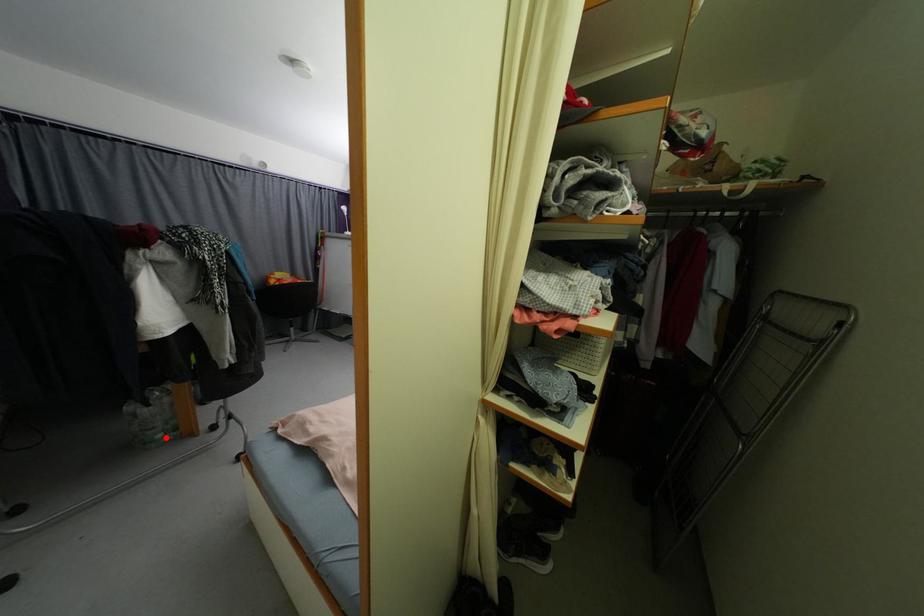
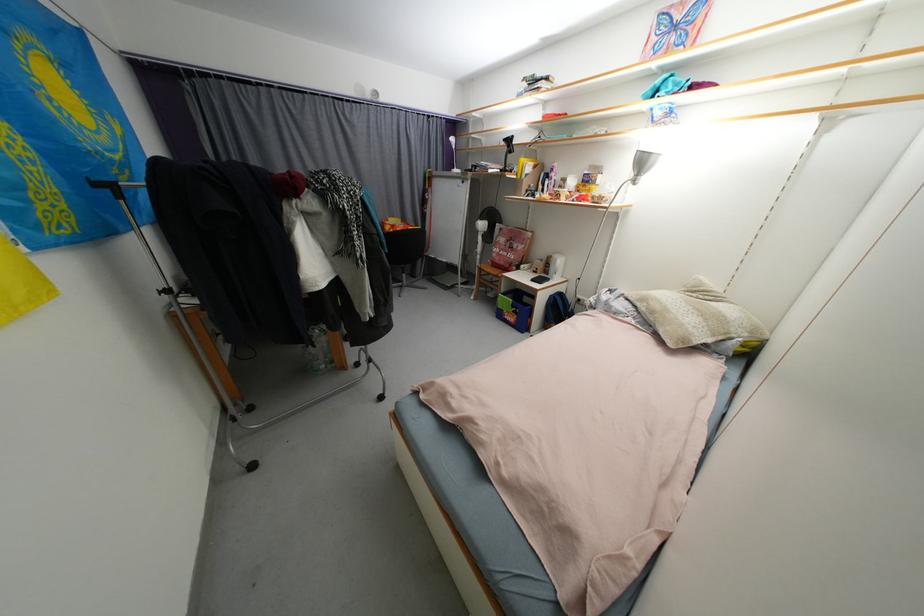
Find the pixel in the second image that matches the highlighted location in the first image.

(329, 368)